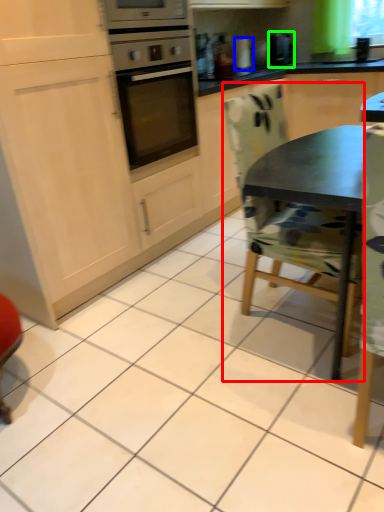
Question: Based on their relative distances, which object is farther from chair (highlighted by a red box)? Choose from appliance (highlighted by a blue box) and coffee machine (highlighted by a green box).

Choices:
 (A) appliance
 (B) coffee machine

Answer: (A)